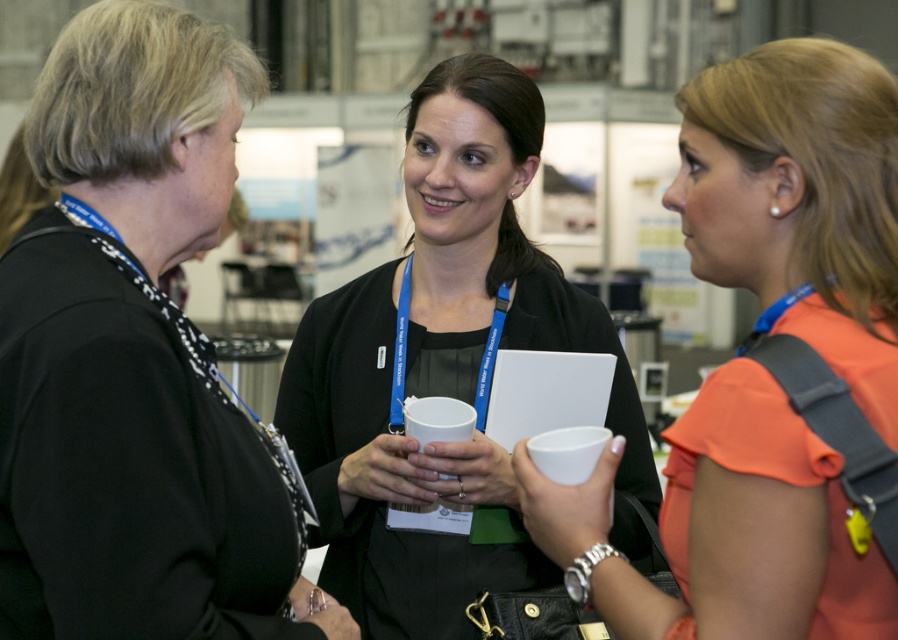
At what (x,y) coordinates should I click in order to perform the action: click on black fabric jacket at upper left. Please return your answer as a coordinate pair (x, y). Image resolution: width=898 pixels, height=640 pixels. Looking at the image, I should click on (133, 356).

Can you confirm if black fabric jacket at upper left is smaller than matte black jacket at center?

Yes, black fabric jacket at upper left is smaller than matte black jacket at center.

Describe the element at coordinates (133, 356) in the screenshot. Image resolution: width=898 pixels, height=640 pixels. I see `black fabric jacket at upper left` at that location.

Image resolution: width=898 pixels, height=640 pixels. Identify the location of black fabric jacket at upper left. (133, 356).

Does orange fabric dress at right appear on the left side of matte black jacket at center?

No, orange fabric dress at right is not to the left of matte black jacket at center.

Which is in front, point (724, 593) or point (368, 563)?

Positioned in front is point (724, 593).

Find the location of a particular element. Image resolution: width=898 pixels, height=640 pixels. orange fabric dress at right is located at coordinates (800, 200).

Which is behind, point (11, 589) or point (760, 579)?

Positioned behind is point (11, 589).

Can you confirm if black fabric jacket at upper left is thinner than orange fabric dress at right?

Yes, black fabric jacket at upper left is thinner than orange fabric dress at right.

Is point (214, 211) farther from camera compared to point (736, 540)?

Yes, it is.

The width and height of the screenshot is (898, 640). I want to click on black fabric jacket at upper left, so click(133, 356).